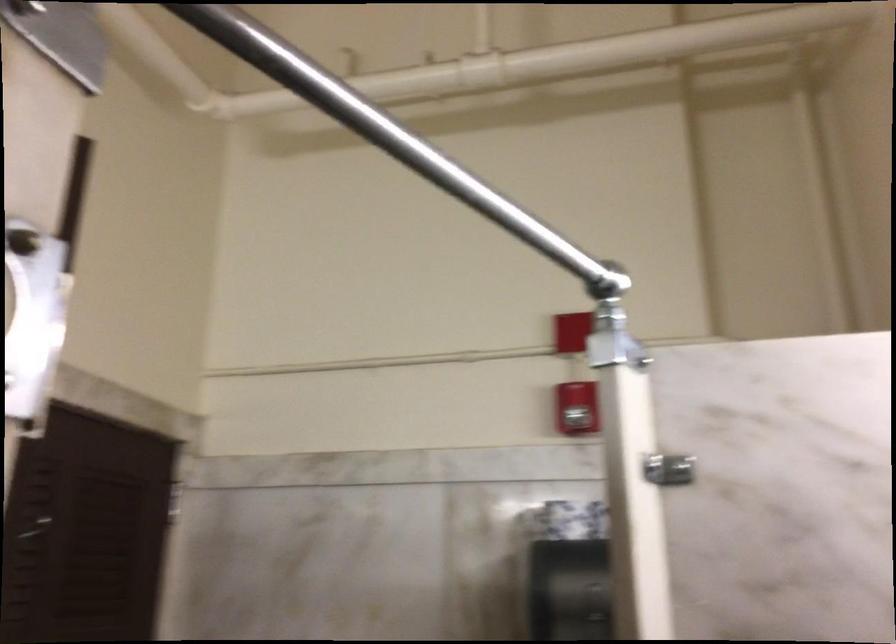
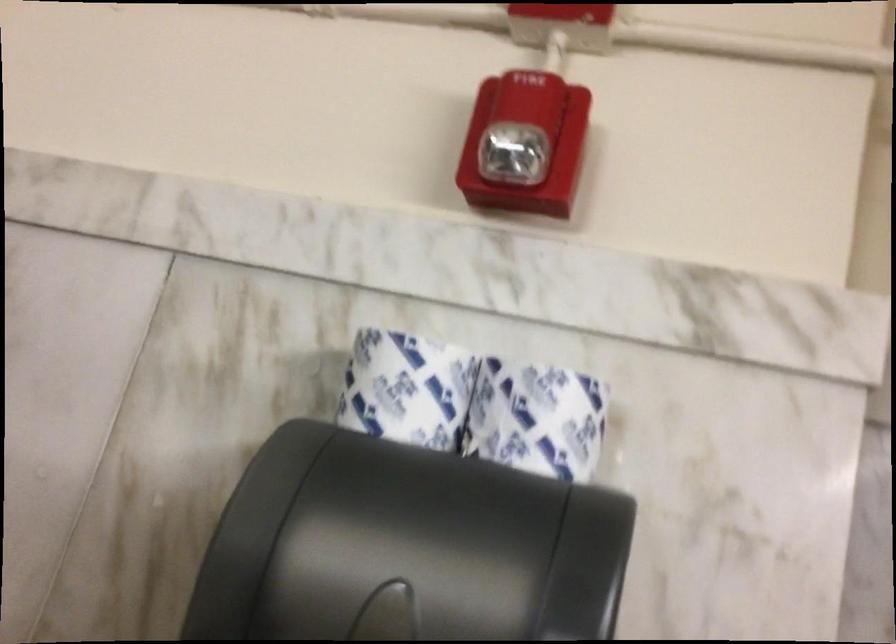
Question: Which direction would the cameraman need to move to produce the second image? Reply with the corresponding letter.

Choices:
 (A) Left
 (B) Right
 (C) Forward
 (D) Backward

Answer: (C)